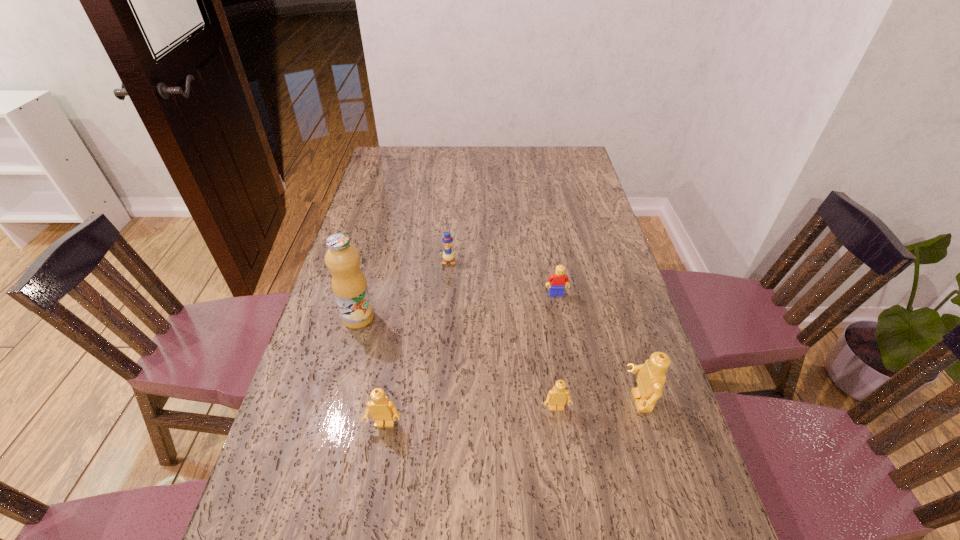
Locate an element on the screen. the second object from left to right is located at coordinates (382, 409).

This screenshot has width=960, height=540. I want to click on the fifth shortest object, so click(651, 378).

This screenshot has height=540, width=960. Identify the location of the rightmost object. (651, 378).

At what (x,y) coordinates should I click in order to perform the action: click on duckling. Please return your answer as a coordinate pair (x, y). Looking at the image, I should click on (448, 255).

You are a GUI agent. You are given a task and a screenshot of the screen. Output one action in this format:
    pyautogui.click(x=<x>, y=<y>)
    Task: Click on the farthest object
    
    Given the screenshot: What is the action you would take?
    pyautogui.click(x=448, y=255)

This screenshot has height=540, width=960. What are the coordinates of `the farthest Lego` in the screenshot? It's located at (558, 279).

This screenshot has width=960, height=540. What are the coordinates of `the third farthest object` in the screenshot? It's located at (349, 284).

You are a GUI agent. You are given a task and a screenshot of the screen. Output one action in this format:
    pyautogui.click(x=<x>, y=<y>)
    Task: Click on the fruit juice
    Image resolution: width=960 pixels, height=540 pixels.
    Given the screenshot: What is the action you would take?
    pyautogui.click(x=349, y=284)

The image size is (960, 540). In order to click on vacant space located 0.160m on the face of the second object from left to right in this screenshot , I will do `click(371, 509)`.

I want to click on vacant space located on the face of the rightmost Lego, so click(x=475, y=401).